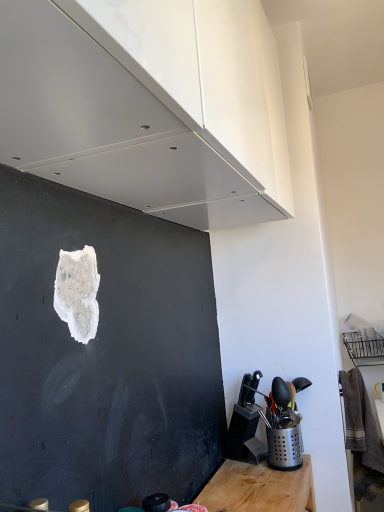
Question: Is point (4, 74) closer or farther from the camera than point (273, 454)?

Choices:
 (A) closer
 (B) farther

Answer: (A)

Question: From a real-world perspective, is white glossy cabinet at upper center physically located above or below silver perforated utensil holder at lower right?

Choices:
 (A) below
 (B) above

Answer: (B)

Question: Is white glossy cabinet at upper center bigger or smaller than silver perforated utensil holder at lower right?

Choices:
 (A) small
 (B) big

Answer: (B)

Question: Does point (269, 442) appear closer or farther from the camera than point (183, 26)?

Choices:
 (A) farther
 (B) closer

Answer: (A)

Question: Is silver perforated utensil holder at lower right inside the boundaries of white glossy cabinet at upper center, or outside?

Choices:
 (A) inside
 (B) outside

Answer: (B)

Question: Considering the relative positions of silver perforated utensil holder at lower right and white glossy cabinet at upper center in the image provided, is silver perforated utensil holder at lower right to the left or to the right of white glossy cabinet at upper center?

Choices:
 (A) left
 (B) right

Answer: (B)

Question: Considering the positions of silver perforated utensil holder at lower right and white glossy cabinet at upper center in the image, is silver perforated utensil holder at lower right taller or shorter than white glossy cabinet at upper center?

Choices:
 (A) short
 (B) tall

Answer: (A)